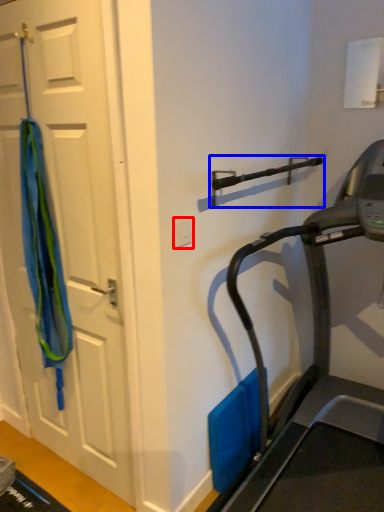
Question: Which point is closer to the camera, electric outlet (highlighted by a red box) or door handle (highlighted by a blue box)?

Choices:
 (A) electric outlet
 (B) door handle

Answer: (B)